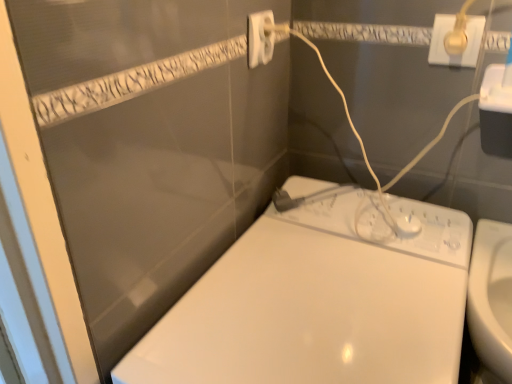
Question: In terms of size, does gold metallic plug at upper right, which is the second power plugs and sockets from left to right, appear bigger or smaller than white plastic power plug at upper center, positioned as the first power plugs and sockets in left-to-right order?

Choices:
 (A) big
 (B) small

Answer: (B)

Question: From the image's perspective, relative to white plastic power plug at upper center, which appears as the 2th power plugs and sockets when viewed from the right, is gold metallic plug at upper right, which appears as the first power plugs and sockets when viewed from the right, above or below?

Choices:
 (A) below
 (B) above

Answer: (A)

Question: Which object is positioned closest to the white plastic power plug at upper center, positioned as the first power plugs and sockets in left-to-right order?

Choices:
 (A) gold metallic plug at upper right, which appears as the first power plugs and sockets when viewed from the right
 (B) white glossy toilet at lower right

Answer: (A)

Question: Considering the real-world distances, which object is farthest from the white plastic power plug at upper center, positioned as the first power plugs and sockets in left-to-right order?

Choices:
 (A) gold metallic plug at upper right, which is the second power plugs and sockets from left to right
 (B) white glossy toilet at lower right

Answer: (B)